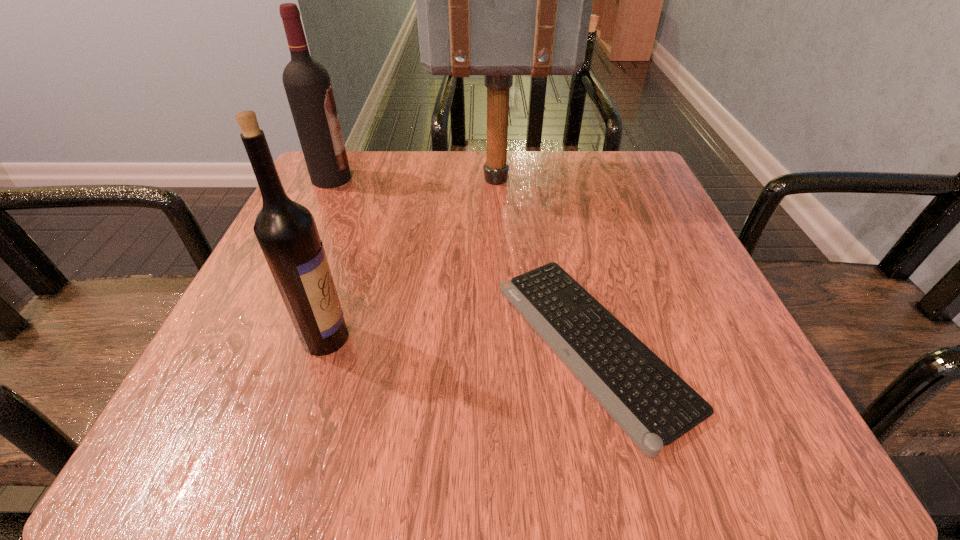
Locate an element on the screen. Image resolution: width=960 pixels, height=540 pixels. vacant space at the left edge of the desktop is located at coordinates (338, 272).

Locate an element on the screen. This screenshot has width=960, height=540. vacant space at the right edge of the desktop is located at coordinates (655, 237).

In order to click on vacant space at the far left corner of the desktop in this screenshot , I will do `click(376, 164)`.

The image size is (960, 540). Identify the location of vacant area at the near left corner. (204, 410).

Find the location of `free space between the mallet and the nearer wine bottle`. free space between the mallet and the nearer wine bottle is located at coordinates (412, 259).

This screenshot has height=540, width=960. Identify the location of free space between the farther wine bottle and the second object from left to right. (328, 258).

Where is `free space between the farther wine bottle and the right wine bottle`? Image resolution: width=960 pixels, height=540 pixels. free space between the farther wine bottle and the right wine bottle is located at coordinates (328, 258).

Where is `vacant area between the tallest object and the shortest object`? This screenshot has width=960, height=540. vacant area between the tallest object and the shortest object is located at coordinates (544, 262).

The image size is (960, 540). What are the coordinates of `free space between the second object from left to right and the leftmost object` in the screenshot? It's located at (328, 258).

I want to click on vacant space that is in between the shortest object and the mallet, so click(x=544, y=262).